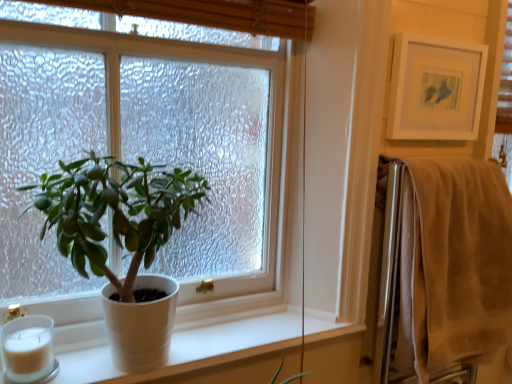
The height and width of the screenshot is (384, 512). What do you see at coordinates (435, 88) in the screenshot?
I see `white matte picture frame at upper right` at bounding box center [435, 88].

Identify the location of white matte pot at left. Image resolution: width=512 pixels, height=384 pixels. (115, 212).

The height and width of the screenshot is (384, 512). I want to click on white textured window at center, so click(x=141, y=153).

This screenshot has height=384, width=512. In order to click on white matte window sill at lower left in this screenshot , I will do `click(193, 353)`.

Where is `white matte picture frame at upper right`? The height and width of the screenshot is (384, 512). white matte picture frame at upper right is located at coordinates (435, 88).

What's the angular difference between white matte candle at lower left and white matte picture frame at upper right's facing directions?

The angular difference between white matte candle at lower left and white matte picture frame at upper right is 1.52 degrees.

Who is shorter, white matte candle at lower left or white matte picture frame at upper right?

white matte candle at lower left.

Is white matte candle at lower left facing away from white matte picture frame at upper right?

No, white matte candle at lower left is not facing the opposite direction of white matte picture frame at upper right.

Is white matte candle at lower left closer to camera compared to white matte picture frame at upper right?

Yes, it is in front of white matte picture frame at upper right.

Between beige cotton towel at right and white textured window at center, which one has larger width?

white textured window at center is wider.

Image resolution: width=512 pixels, height=384 pixels. What are the coordinates of `bath towel behind the white textured window at center` in the screenshot? It's located at (453, 265).

How many degrees apart are the facing directions of beige cotton towel at right and white textured window at center?

The angular difference between beige cotton towel at right and white textured window at center is 0.723 degrees.

Which is behind, beige cotton towel at right or white textured window at center?

beige cotton towel at right is further away from the camera.

Considering the sizes of white matte picture frame at upper right and beige cotton towel at right in the image, is white matte picture frame at upper right taller or shorter than beige cotton towel at right?

In the image, white matte picture frame at upper right appears to be shorter than beige cotton towel at right.

Considering the sizes of objects white matte picture frame at upper right and beige cotton towel at right in the image provided, who is bigger, white matte picture frame at upper right or beige cotton towel at right?

With larger size is beige cotton towel at right.

From the picture: Is white matte picture frame at upper right directly adjacent to beige cotton towel at right?

No, white matte picture frame at upper right is not touching beige cotton towel at right.

Which is more to the left, white textured window at center or white matte picture frame at upper right?

Positioned to the left is white textured window at center.

From the image's perspective, between white textured window at center and white matte picture frame at upper right, which one is located above?

white matte picture frame at upper right is shown above in the image.

Is white textured window at center wider than white matte picture frame at upper right?

Indeed, white textured window at center has a greater width compared to white matte picture frame at upper right.

From the picture: From a real-world perspective, between beige cotton towel at right and white matte candle at lower left, who is vertically lower?

white matte candle at lower left is physically lower.

Can you confirm if beige cotton towel at right is taller than white matte candle at lower left?

Correct, beige cotton towel at right is much taller as white matte candle at lower left.

Between beige cotton towel at right and white matte candle at lower left, which one has smaller width?

white matte candle at lower left is thinner.

Is beige cotton towel at right surrounding white matte window sill at lower left?

Definitely not — white matte window sill at lower left is not inside beige cotton towel at right.

Considering the relative positions of beige cotton towel at right and white matte window sill at lower left in the image provided, is beige cotton towel at right to the left of white matte window sill at lower left from the viewer's perspective?

In fact, beige cotton towel at right is to the right of white matte window sill at lower left.

From the image's perspective, is beige cotton towel at right beneath white matte window sill at lower left?

Actually, beige cotton towel at right appears above white matte window sill at lower left in the image.

Which of these two, beige cotton towel at right or white matte window sill at lower left, is smaller?

white matte window sill at lower left is smaller.

Which of these two, white matte pot at left or white matte picture frame at upper right, stands shorter?

With less height is white matte picture frame at upper right.

From a real-world perspective, which is physically above, white matte pot at left or white matte picture frame at upper right?

white matte picture frame at upper right, from a real-world perspective.

Does point (92, 183) lie behind point (468, 115)?

No, it is in front of (468, 115).

Where is `picture frame located on the right of white matte candle at lower left`? picture frame located on the right of white matte candle at lower left is located at coordinates (435, 88).

The width and height of the screenshot is (512, 384). What are the coordinates of `window that is above the beige cotton towel at right (from the image's perspective)` in the screenshot? It's located at (141, 153).

Which object lies nearer to the anchor point white matte picture frame at upper right, white textured window at center or white matte candle at lower left?

The object closer to white matte picture frame at upper right is white textured window at center.

Estimate the real-world distances between objects in this image. Which object is further from white matte picture frame at upper right, white matte pot at left or white textured window at center?

white matte pot at left lies further to white matte picture frame at upper right than the other object.

When comparing their distances from white matte picture frame at upper right, does beige cotton towel at right or white matte candle at lower left seem closer?

The object closer to white matte picture frame at upper right is beige cotton towel at right.

Looking at the image, which one is located further to white matte picture frame at upper right, beige cotton towel at right or white matte pot at left?

white matte pot at left.

Based on their spatial positions, is beige cotton towel at right or white matte picture frame at upper right further from white matte candle at lower left?

Among the two, white matte picture frame at upper right is located further to white matte candle at lower left.

From the image, which object appears to be nearer to white matte candle at lower left, beige cotton towel at right or white matte window sill at lower left?

white matte window sill at lower left lies closer to white matte candle at lower left than the other object.

Looking at the image, which one is located further to white matte window sill at lower left, beige cotton towel at right or white matte candle at lower left?

beige cotton towel at right.

Estimate the real-world distances between objects in this image. Which object is closer to white matte picture frame at upper right, white matte candle at lower left or white matte window sill at lower left?

white matte window sill at lower left is closer to white matte picture frame at upper right.

Where is `houseplant located between white matte candle at lower left and white matte picture frame at upper right in the left-right direction`? houseplant located between white matte candle at lower left and white matte picture frame at upper right in the left-right direction is located at coordinates (115, 212).

I want to click on houseplant that lies between white textured window at center and white matte candle at lower left from top to bottom, so click(115, 212).

Where is `picture frame located between white matte window sill at lower left and beige cotton towel at right in the left-right direction`? The image size is (512, 384). picture frame located between white matte window sill at lower left and beige cotton towel at right in the left-right direction is located at coordinates (435, 88).

This screenshot has height=384, width=512. What are the coordinates of `window sill between white matte candle at lower left and beige cotton towel at right` in the screenshot? It's located at (193, 353).